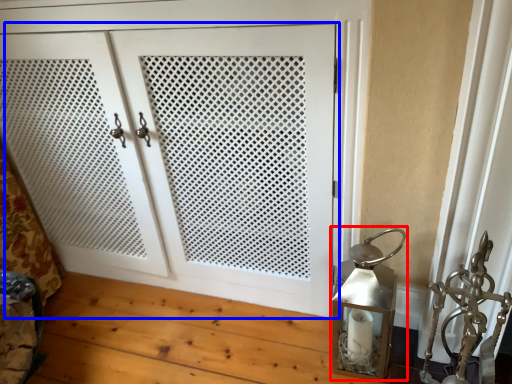
Question: Which object is closer to the camera taking this photo, table lamp (highlighted by a red box) or door (highlighted by a blue box)?

Choices:
 (A) table lamp
 (B) door

Answer: (B)